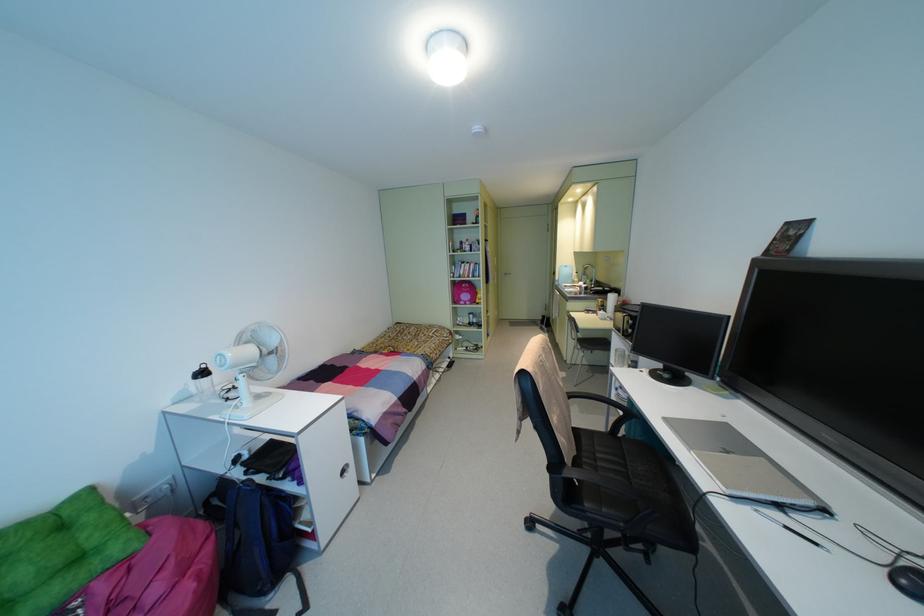
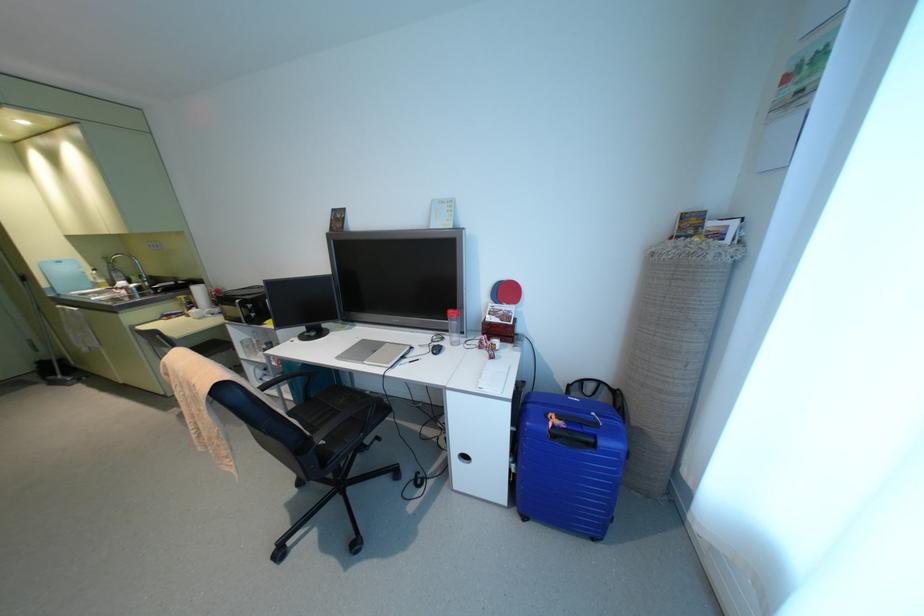
First-person continuous shooting, in which direction is the camera rotating?

The rotation direction of the camera is right-down.